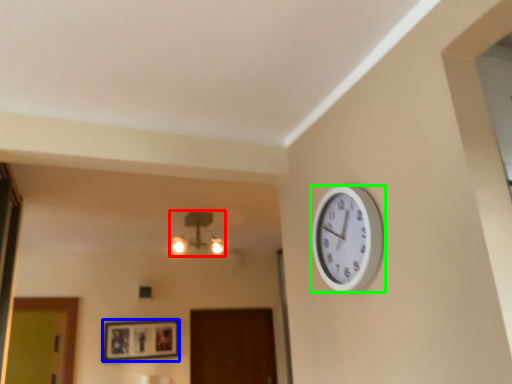
Question: Which object is positioned farthest from lamp (highlighted by a red box)? Select from picture frame (highlighted by a blue box) and wall clock (highlighted by a green box).

Choices:
 (A) picture frame
 (B) wall clock

Answer: (B)